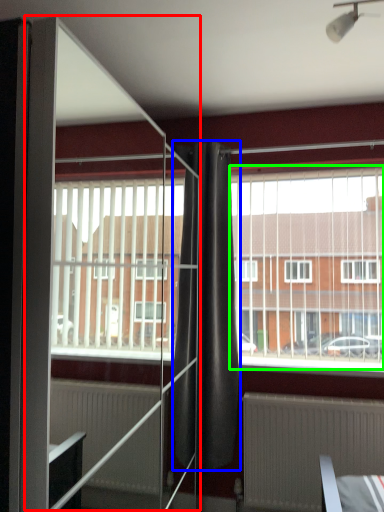
Question: Which object is positioned farthest from screen door (highlighted by a red box)? Select from curtain (highlighted by a blue box) and window screen (highlighted by a green box).

Choices:
 (A) curtain
 (B) window screen

Answer: (B)